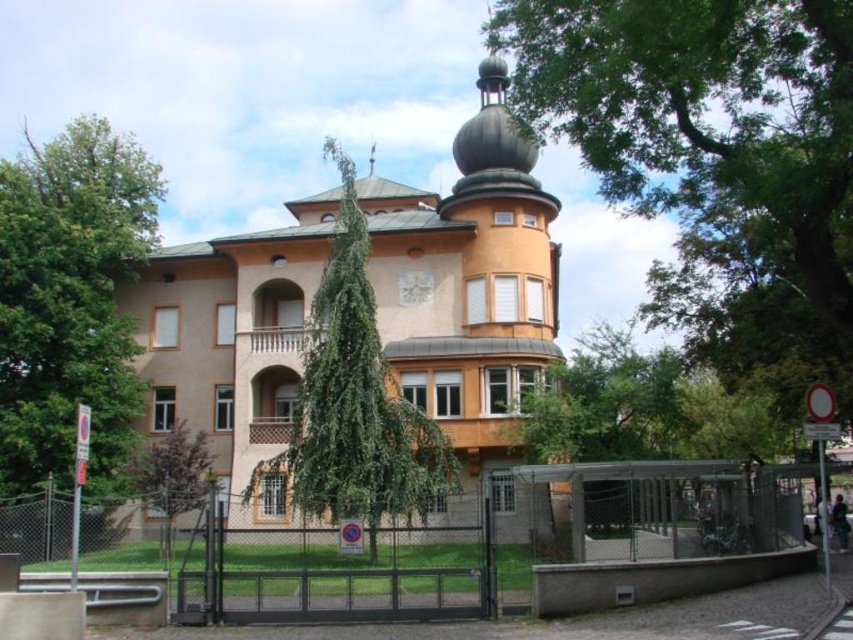
From the picture: Who is higher up, green leafy tree at upper center or black metal fence at lower center?

green leafy tree at upper center

Does green leafy tree at upper center have a smaller size compared to black metal fence at lower center?

Actually, green leafy tree at upper center might be larger than black metal fence at lower center.

Is point (821, 236) closer to camera compared to point (554, 573)?

No, (821, 236) is further to viewer.

The height and width of the screenshot is (640, 853). What are the coordinates of `green leafy tree at upper center` in the screenshot? It's located at (714, 161).

Does point (846, 285) come farther from viewer compared to point (186, 492)?

No, it is not.

Is point (730, 356) positioned after point (161, 456)?

Yes, it is.

Image resolution: width=853 pixels, height=640 pixels. I want to click on green leafy tree at upper center, so click(714, 161).

Is green leafy tree at upper center bigger than green leafy tree at left?

No.

Does green leafy tree at upper center have a lesser height compared to green leafy tree at left?

Indeed, green leafy tree at upper center has a lesser height compared to green leafy tree at left.

I want to click on green leafy tree at upper center, so click(714, 161).